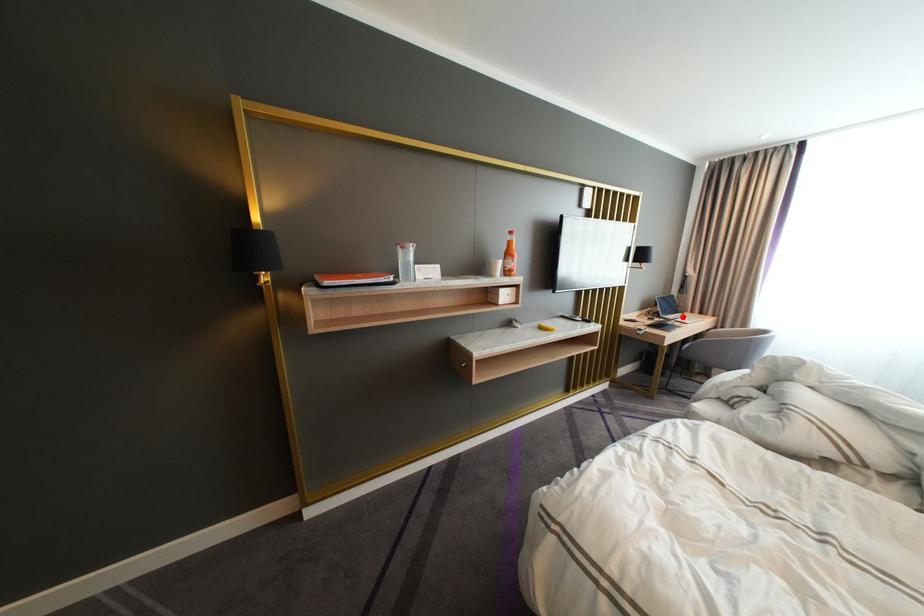
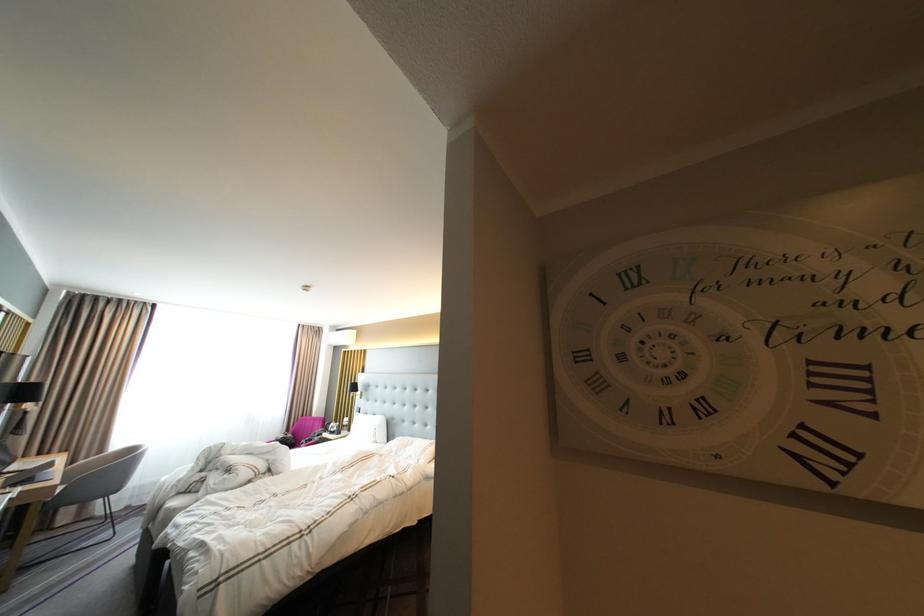
The point at the highlighted location is marked in the first image. Where is the corresponding point in the second image?

(27, 468)